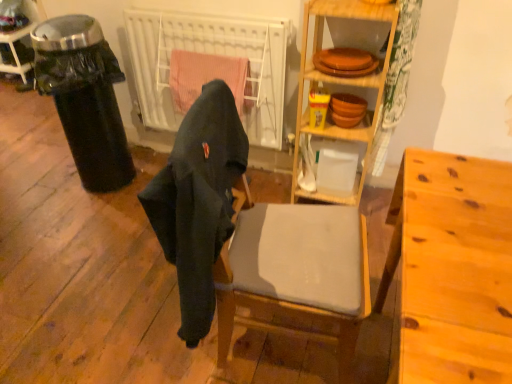
Question: Considering the positions of black plastic trash can at left and dark gray fabric chair at center in the image, is black plastic trash can at left taller or shorter than dark gray fabric chair at center?

Choices:
 (A) tall
 (B) short

Answer: (A)

Question: Which is correct: black plastic trash can at left is inside dark gray fabric chair at center, or outside of it?

Choices:
 (A) outside
 (B) inside

Answer: (A)

Question: Based on their relative distances, which object is farther from the matte gray cushioned chair at center?

Choices:
 (A) light brown wood desk at right
 (B) dark gray fabric chair at center
 (C) wooden shelves at center
 (D) white matte radiator at center
 (E) metallic trash can at left

Answer: (E)

Question: Which is farther from the white matte radiator at center?

Choices:
 (A) matte gray cushioned chair at center
 (B) dark gray fabric chair at center
 (C) wooden shelves at center
 (D) light brown wood desk at right
 (E) black plastic trash can at left

Answer: (D)